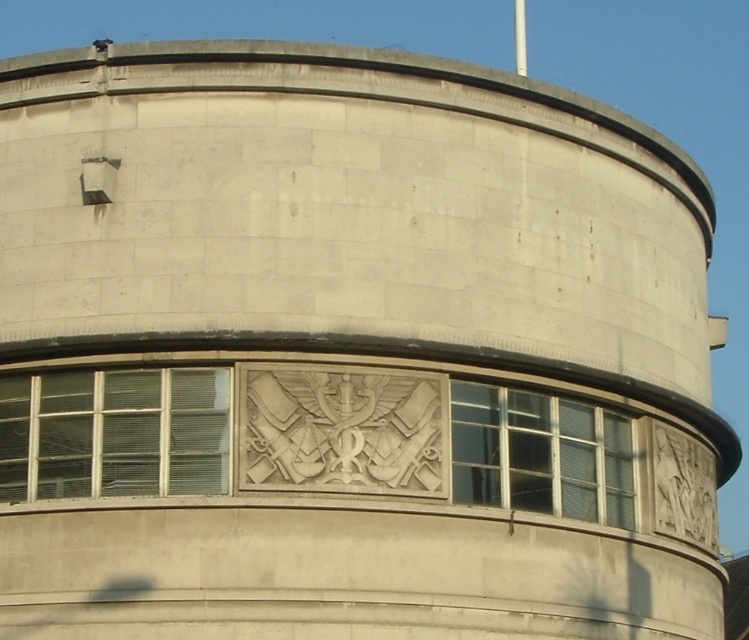
You are standing in front of the cylindrical building. You want to locate the clear glass window at lower left. Where should you look relative to the building?

The clear glass window at lower left is located at the lower left side of the cylindrical building, specifically at the 2D coordinates point [115,433].

You are standing in front of the cylindrical building and want to locate the clear glass window at center. Which direction should you move relative to the clear glass window at lower left to find it?

The clear glass window at lower left is positioned on the left side of clear glass window at center, so you should move to the right relative to the clear glass window at lower left to find the clear glass window at center.

You are standing in front of the cylindrical building and want to determine the relative positions of two points marked on its facade. Which point is closer to you, point (198, 420) or point (595, 470)?

Point (198, 420) is closer to the viewer than point (595, 470).